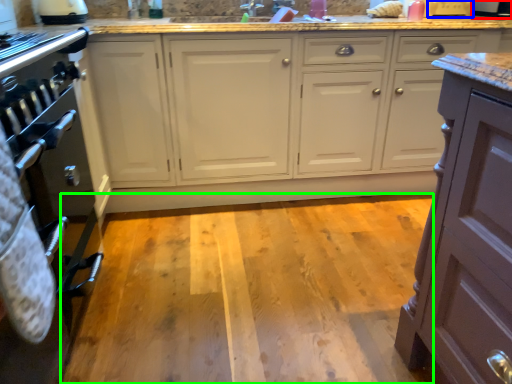
Question: Which object is positioned closest to appliance (highlighted by a red box)? Select from appliance (highlighted by a blue box) and plain (highlighted by a green box).

Choices:
 (A) appliance
 (B) plain

Answer: (A)